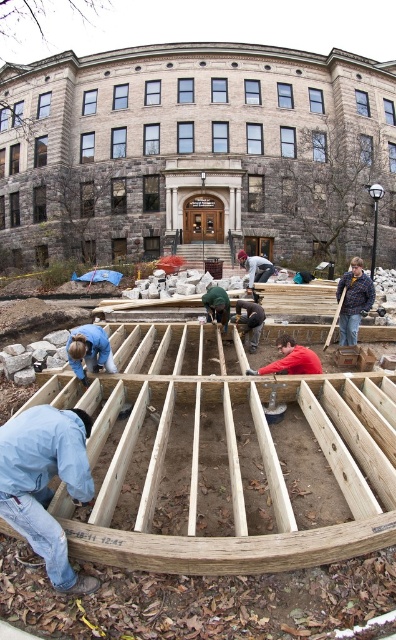
Image resolution: width=396 pixels, height=640 pixels. Describe the element at coordinates (226, 460) in the screenshot. I see `natural wood frame at center` at that location.

From the picture: Can you confirm if natural wood frame at center is positioned above light blue denim jacket at lower left?

Yes.

This screenshot has height=640, width=396. Describe the element at coordinates (226, 460) in the screenshot. I see `natural wood frame at center` at that location.

Identify the location of natural wood frame at center. (226, 460).

Who is more forward, (249, 173) or (258, 531)?

Point (258, 531)

Which is above, wooden frame at center or natural wood frame at center?

wooden frame at center

Is point (285, 154) more distant than point (234, 484)?

Yes.

At what (x,y) coordinates should I click in order to perform the action: click on wooden frame at center. Please return your answer as a coordinate pair (x, y). This screenshot has height=640, width=396. Looking at the image, I should click on (192, 150).

Is wooden frame at center below light blue denim jacket at lower left?

Actually, wooden frame at center is above light blue denim jacket at lower left.

What do you see at coordinates (192, 150) in the screenshot? Image resolution: width=396 pixels, height=640 pixels. I see `wooden frame at center` at bounding box center [192, 150].

Identify the location of wooden frame at center. (192, 150).